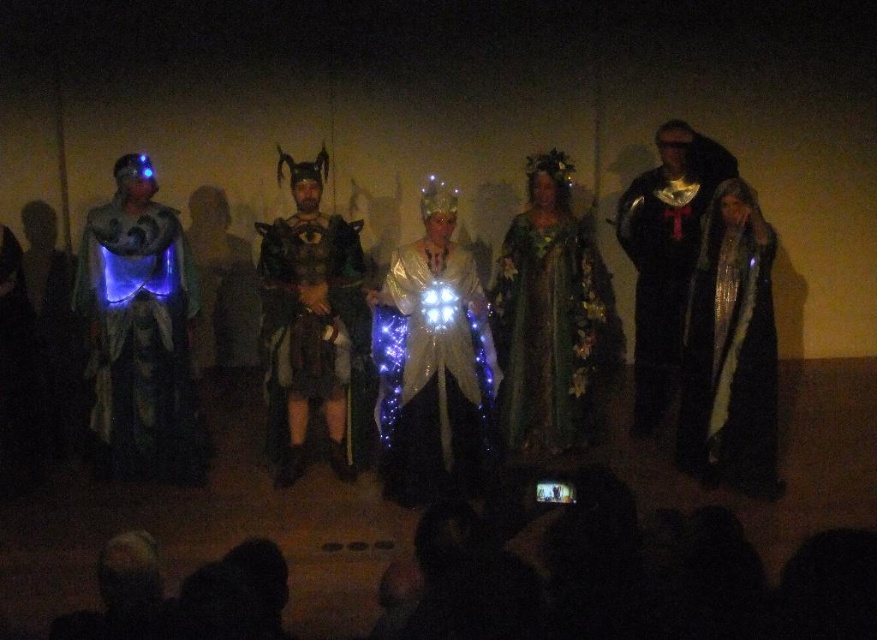
Question: Which object appears farthest from the camera in this image?

Choices:
 (A) iridescent sequined robe at center
 (B) black velvet cape at center
 (C) green floral dress at center
 (D) shiny silver robe at right

Answer: (B)

Question: Is luminous fabric cape at left to the right of shiny silver robe at right from the viewer's perspective?

Choices:
 (A) yes
 (B) no

Answer: (B)

Question: Is shiny silver robe at right above green floral dress at center?

Choices:
 (A) yes
 (B) no

Answer: (B)

Question: Which point is closer to the camera?

Choices:
 (A) (761, 483)
 (B) (98, 323)
 (C) (410, 397)

Answer: (C)

Question: Which object is the closest to the shiny silver robe at right?

Choices:
 (A) luminous fabric cape at left
 (B) green floral dress at center

Answer: (B)

Question: Observing the image, what is the correct spatial positioning of luminous fabric cape at left in reference to iridescent sequined robe at center?

Choices:
 (A) left
 (B) right

Answer: (A)